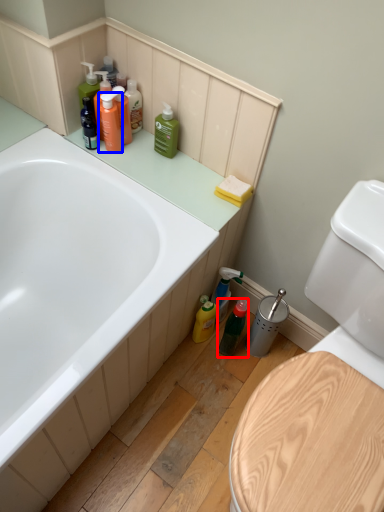
Question: Among these objects, which one is nearest to the camera, mouthwash (highlighted by a red box) or toiletry (highlighted by a blue box)?

Choices:
 (A) mouthwash
 (B) toiletry

Answer: (B)